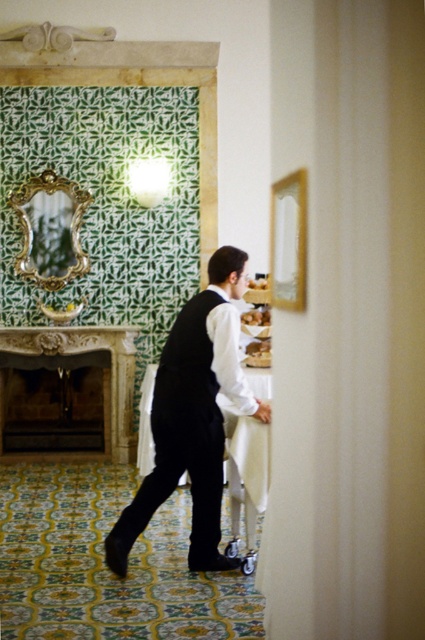
Does black satin vest at center have a smaller size compared to white glossy picture frame at upper right?

No.

Which of these two, black satin vest at center or white glossy picture frame at upper right, stands shorter?

With less height is white glossy picture frame at upper right.

Locate an element on the screen. black satin vest at center is located at coordinates (193, 417).

I want to click on black satin vest at center, so click(x=193, y=417).

This screenshot has height=640, width=425. What do you see at coordinates (193, 417) in the screenshot?
I see `black satin vest at center` at bounding box center [193, 417].

Between point (203, 506) and point (255, 314), which one is positioned behind?

The point (255, 314) is more distant.

The width and height of the screenshot is (425, 640). In order to click on black satin vest at center in this screenshot , I will do `click(193, 417)`.

Is white glossy picture frame at upper right thinner than smooth cream cheese at upper center?

Correct, white glossy picture frame at upper right's width is less than smooth cream cheese at upper center's.

Does point (294, 230) come farther from viewer compared to point (252, 282)?

No, (294, 230) is closer to viewer.

This screenshot has height=640, width=425. Describe the element at coordinates (289, 241) in the screenshot. I see `white glossy picture frame at upper right` at that location.

At what (x,y) coordinates should I click in order to perform the action: click on white glossy picture frame at upper right. Please return your answer as a coordinate pair (x, y). The image size is (425, 640). Looking at the image, I should click on (289, 241).